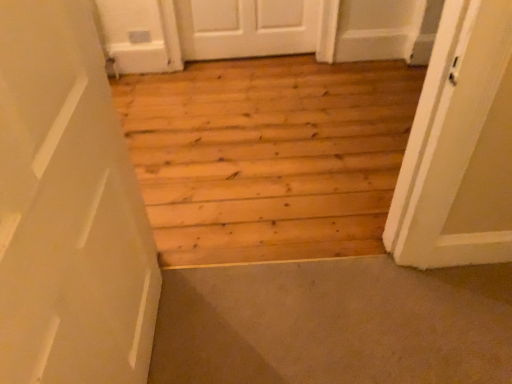
Question: Should I look upward or downward to see carpeted stairwell at lower left?

Choices:
 (A) down
 (B) up

Answer: (A)